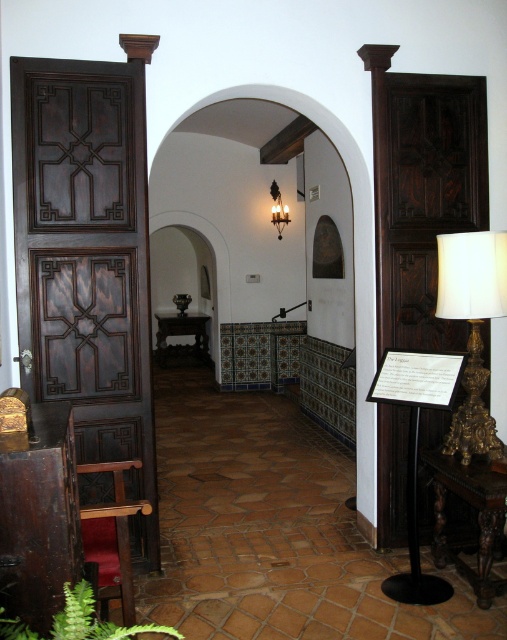
Is dark wood paneling at left thinner than gold ornate lamp at right?

In fact, dark wood paneling at left might be wider than gold ornate lamp at right.

Between dark wood paneling at left and gold ornate lamp at right, which one is positioned lower?

gold ornate lamp at right is below.

Identify the location of dark wood paneling at left. (88, 257).

Which of these two, dark wood carved door at right or matte black sconce at upper center, stands shorter?

Standing shorter between the two is matte black sconce at upper center.

Which is above, dark wood carved door at right or matte black sconce at upper center?

Positioned higher is matte black sconce at upper center.

Where is `dark wood carved door at right`? The width and height of the screenshot is (507, 640). dark wood carved door at right is located at coordinates coord(423,196).

Image resolution: width=507 pixels, height=640 pixels. What are the coordinates of `dark wood carved door at right` in the screenshot? It's located at (423, 196).

Describe the element at coordinates (472, 326) in the screenshot. I see `gold ornate lamp at right` at that location.

Is gold ornate lamp at right closer to the viewer compared to matte black sconce at upper center?

Yes.

Measure the distance between gold ornate lamp at right and camera.

gold ornate lamp at right and camera are 8.92 feet apart.

What are the coordinates of `gold ornate lamp at right` in the screenshot? It's located at (472, 326).